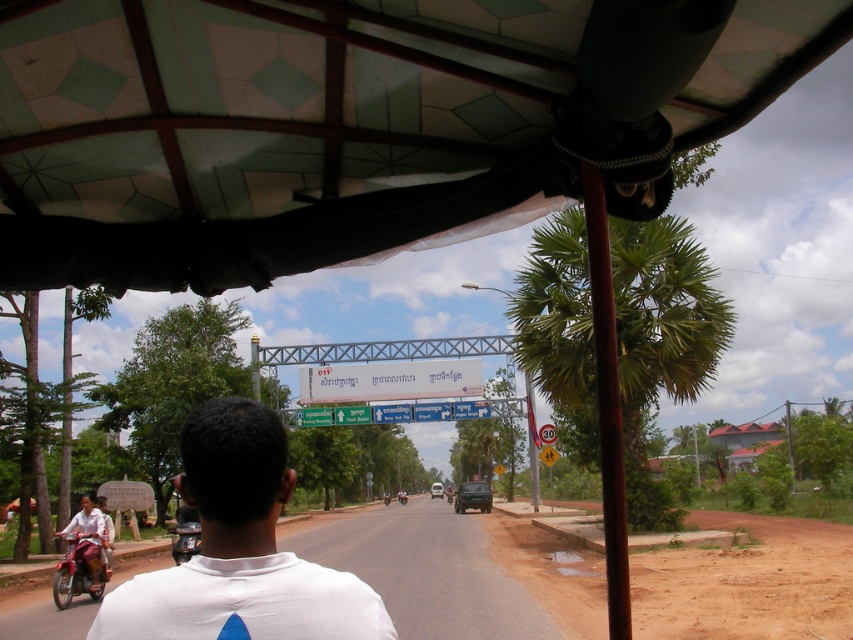
Based on the photo, you are a passenger in the vehicle and want to know if the green leafy palm tree at right is bigger than the white plastic sign at center. Can you confirm this based on what you see?

The green leafy palm tree at right is larger in size than the white plastic sign at center, so yes, the palm tree is bigger than the sign.

You are a passenger in the vehicle. You notice the green leafy palm tree at right and the white plastic sign at center outside the window. Which object appears taller from your viewpoint?

The green leafy palm tree at right appears taller than the white plastic sign at center because it has a greater height compared to the white plastic sign at center.